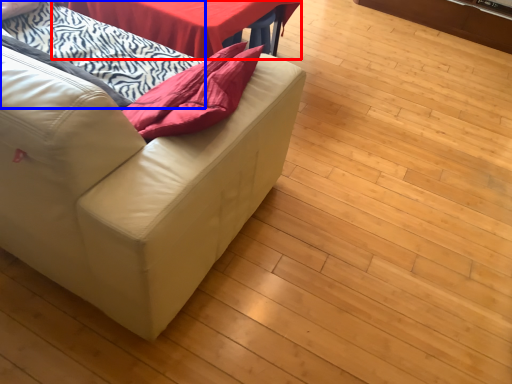
Question: Among these objects, which one is nearest to the camera, table (highlighted by a red box) or blanket (highlighted by a blue box)?

Choices:
 (A) table
 (B) blanket

Answer: (B)